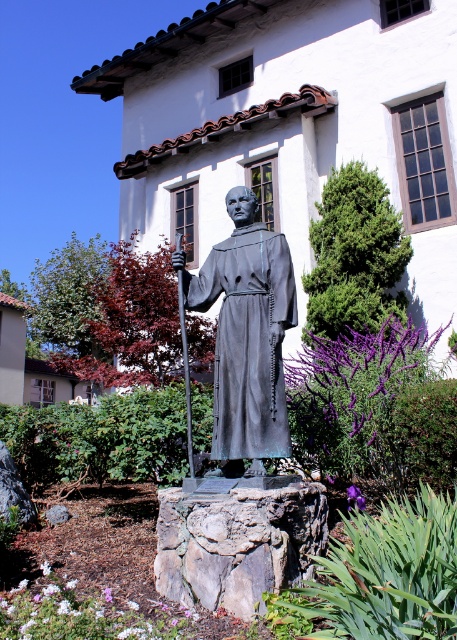
Question: Which of the following is the closest to the observer?

Choices:
 (A) green mossy rock at center
 (B) polished bronze robe at center
 (C) rough textured stone at center

Answer: (C)

Question: Can you confirm if green mossy rock at center is thinner than polished bronze robe at center?

Choices:
 (A) no
 (B) yes

Answer: (A)

Question: Which is nearer to the green mossy rock at center?

Choices:
 (A) polished bronze robe at center
 (B) rough textured stone at center

Answer: (B)

Question: Is the position of rough textured stone at center more distant than that of polished bronze robe at center?

Choices:
 (A) no
 (B) yes

Answer: (A)

Question: Does green mossy rock at center come in front of polished bronze robe at center?

Choices:
 (A) no
 (B) yes

Answer: (A)

Question: Among these objects, which one is farthest from the camera?

Choices:
 (A) green mossy rock at center
 (B) polished bronze robe at center

Answer: (A)